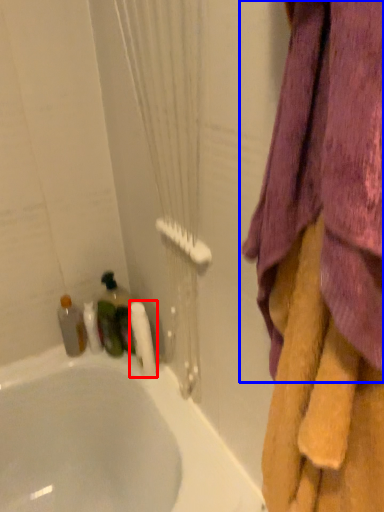
Question: Which of the following is the closest to the observer, toilet paper (highlighted by a red box) or curtain (highlighted by a blue box)?

Choices:
 (A) toilet paper
 (B) curtain

Answer: (B)